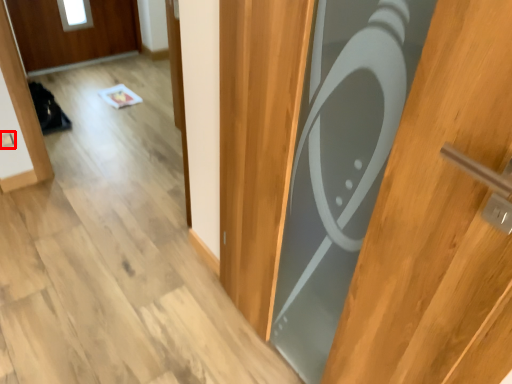
Question: Where is electric outlet (annotated by the red box) located in relation to door in the image?

Choices:
 (A) right
 (B) left

Answer: (B)